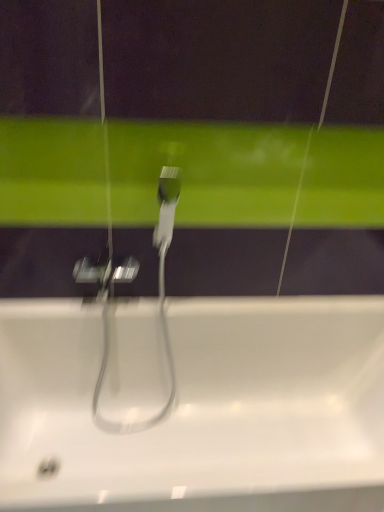
Identify the location of white glossy sink at center. This screenshot has width=384, height=512. (201, 405).

Describe the element at coordinates (201, 405) in the screenshot. I see `white glossy sink at center` at that location.

This screenshot has height=512, width=384. I want to click on white glossy sink at center, so click(x=201, y=405).